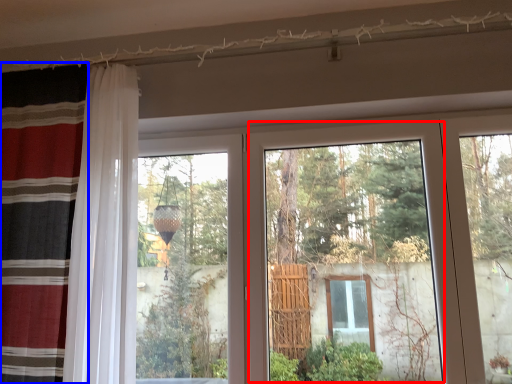
Question: Which of the following is the closest to the observer, glass door (highlighted by a red box) or curtain (highlighted by a blue box)?

Choices:
 (A) glass door
 (B) curtain

Answer: (B)